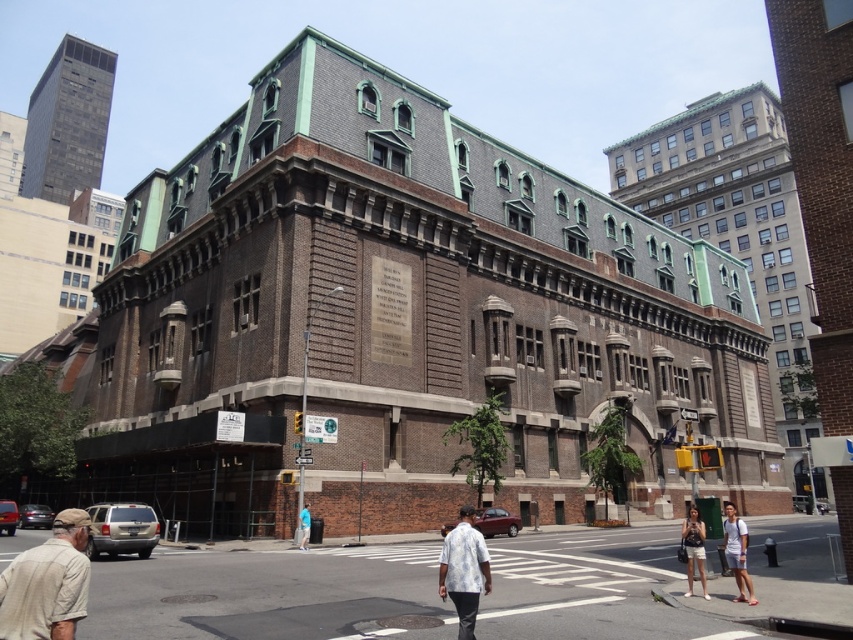
You are standing in front of the historic building and notice two items of clothing nearby. You see a white floral shirt at center and denim shorts at lower right. You want to pick up both items. Which one is closer to you?

The white floral shirt at center is closer to you than the denim shorts at lower right since they are 14.65 meters apart.

You are a tailor who needs to determine which shirt to alter first. You have a limited amount of fabric that can only accommodate alterations requiring up to 1 meter of additional width. The beige cotton shirt at lower left and the white floral shirt at center are both in need of widening. Based on their current widths, which shirt should you prioritize altering first if you want to ensure you can complete both alterations with the available fabric?

The beige cotton shirt at lower left might be wider than white floral shirt at center, so you should prioritize altering the white floral shirt at center first to ensure there is enough fabric remaining for the potentially wider beige cotton shirt at lower left.